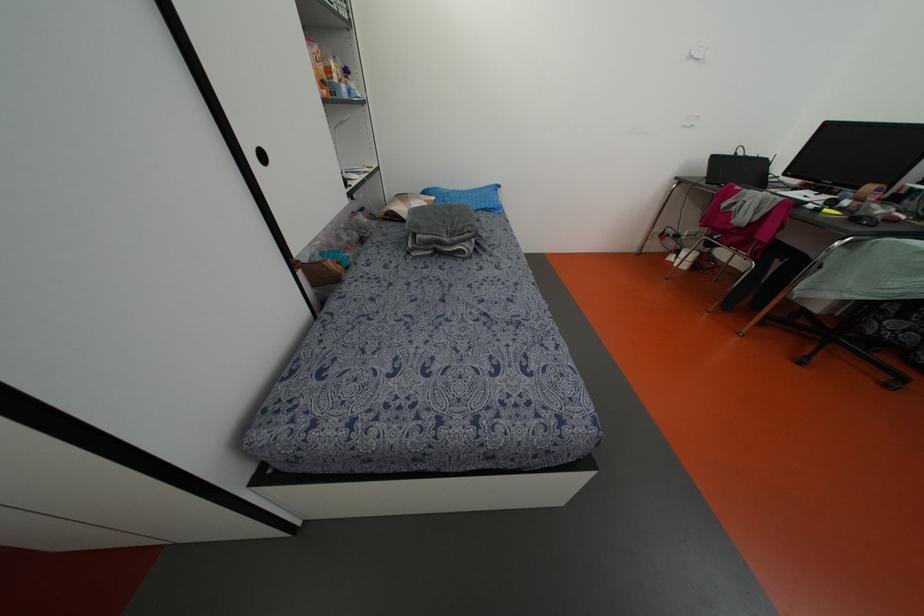
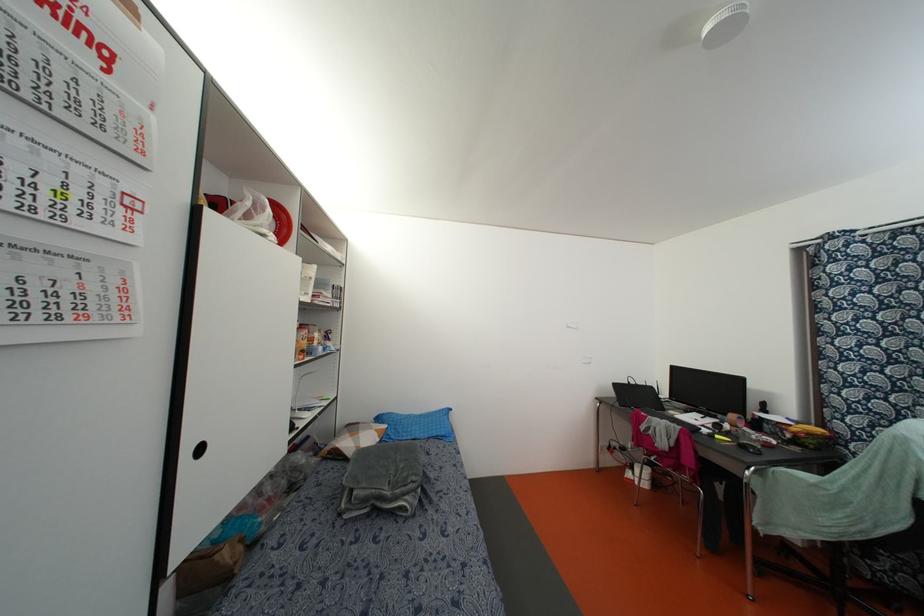
Question: The first image is from the beginning of the video and the second image is from the end. How did the camera likely rotate when shooting the video?

Choices:
 (A) Left
 (B) Right
 (C) Up
 (D) Down

Answer: (C)